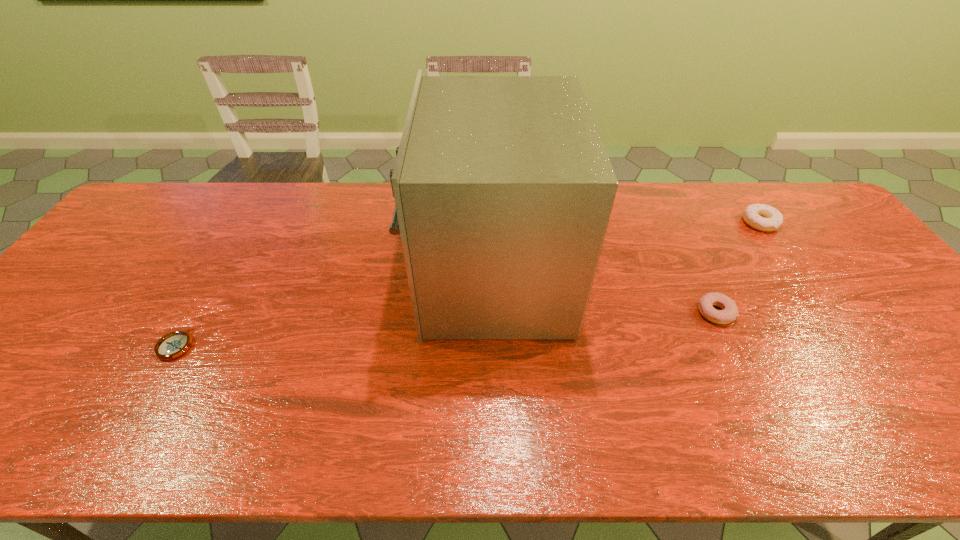
This screenshot has width=960, height=540. I want to click on free space located on the front panel of the toaster oven, so click(326, 275).

Where is `vacant space located on the front of the right doughnut`? The image size is (960, 540). vacant space located on the front of the right doughnut is located at coordinates (794, 272).

I want to click on vacant space situated on the right of the shorter doughnut, so click(847, 312).

The width and height of the screenshot is (960, 540). What are the coordinates of `free region located 0.170m on the left of the leftmost object` in the screenshot? It's located at (88, 345).

This screenshot has height=540, width=960. Identify the location of toaster oven that is at the far edge. (503, 188).

The width and height of the screenshot is (960, 540). What are the coordinates of `doughnut situated at the far edge` in the screenshot? It's located at (761, 217).

You are a GUI agent. You are given a task and a screenshot of the screen. Output one action in this format:
    pyautogui.click(x=<x>, y=<y>)
    Task: Click on the free space at the far edge of the desktop
    The width and height of the screenshot is (960, 540).
    Given the screenshot: What is the action you would take?
    pyautogui.click(x=228, y=192)

The image size is (960, 540). In the image, there is a desktop. Identify the location of free space at the near edge. (152, 457).

In order to click on vacant space at the right edge of the desktop in this screenshot , I will do coord(834,251).

Find the location of a particular element. blank space at the far left corner of the desktop is located at coordinates click(x=163, y=184).